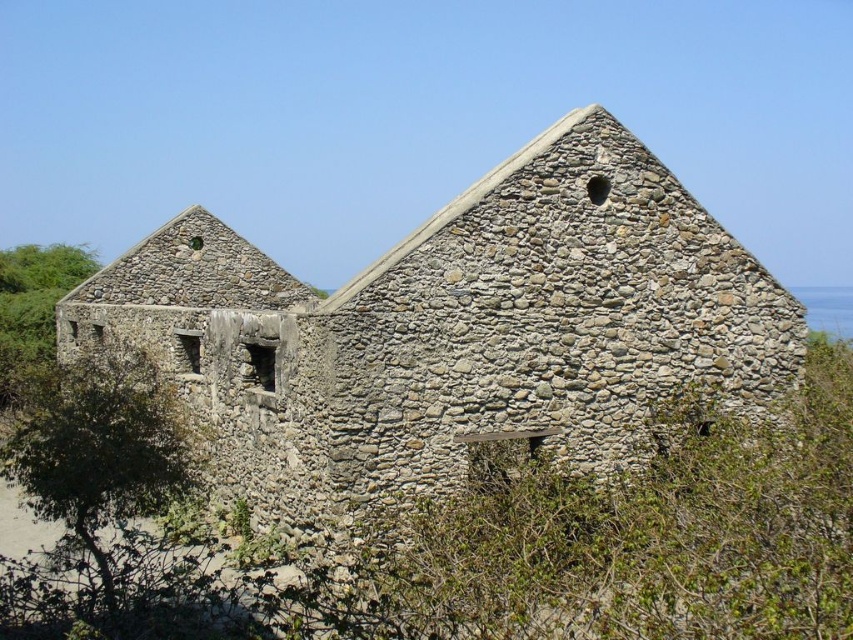
Does gray stone building at center appear on the right side of green leafy bush at center?

In fact, gray stone building at center is to the left of green leafy bush at center.

Does point (199, 237) lie in front of point (656, 552)?

No, (199, 237) is further to viewer.

Measure the distance between point [192,396] and camera.

Point [192,396] is 42.66 meters away from camera.

Where is `gray stone building at center`? The image size is (853, 640). gray stone building at center is located at coordinates (453, 332).

Is point (573, 365) closer to camera compared to point (32, 336)?

Yes, it is.

Can you confirm if gray stone building at center is positioned to the left of green leafy bush at left?

Incorrect, gray stone building at center is not on the left side of green leafy bush at left.

Is point (569, 435) farther from camera compared to point (33, 285)?

No, it is in front of (33, 285).

Image resolution: width=853 pixels, height=640 pixels. Find the location of `gray stone building at center`. gray stone building at center is located at coordinates (453, 332).

Is gray stone building at center to the right of green leafy tree at lower left from the viewer's perspective?

Correct, you'll find gray stone building at center to the right of green leafy tree at lower left.

How much distance is there between gray stone building at center and green leafy tree at lower left?

gray stone building at center and green leafy tree at lower left are 7.71 meters apart.

You are a GUI agent. You are given a task and a screenshot of the screen. Output one action in this format:
    pyautogui.click(x=<x>, y=<y>)
    Task: Click on the gray stone building at center
    The width and height of the screenshot is (853, 640).
    Given the screenshot: What is the action you would take?
    pyautogui.click(x=453, y=332)

You are a GUI agent. You are given a task and a screenshot of the screen. Output one action in this format:
    pyautogui.click(x=<x>, y=<y>)
    Task: Click on the gray stone building at center
    The width and height of the screenshot is (853, 640).
    Given the screenshot: What is the action you would take?
    pyautogui.click(x=453, y=332)